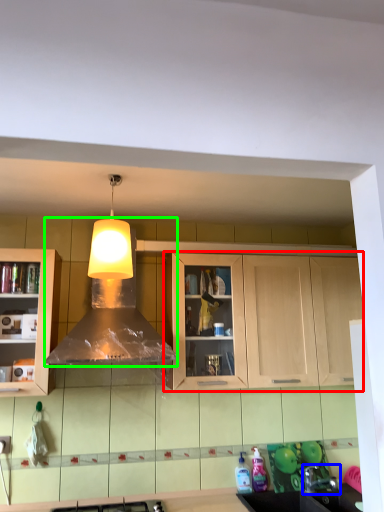
Question: Which is nearer to the cabinetry (highlighted by a red box)? faucet (highlighted by a blue box) or hood (highlighted by a green box).

Choices:
 (A) faucet
 (B) hood

Answer: (B)